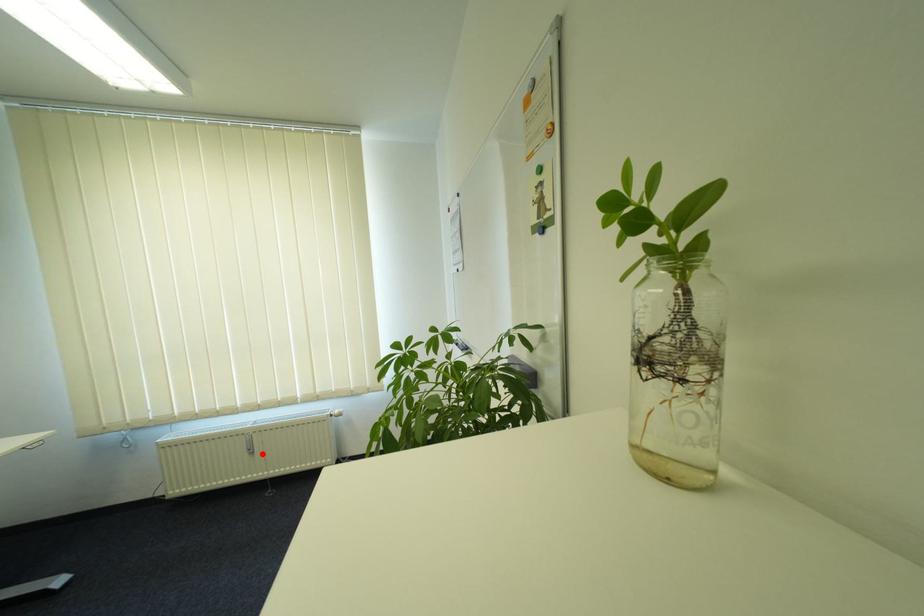
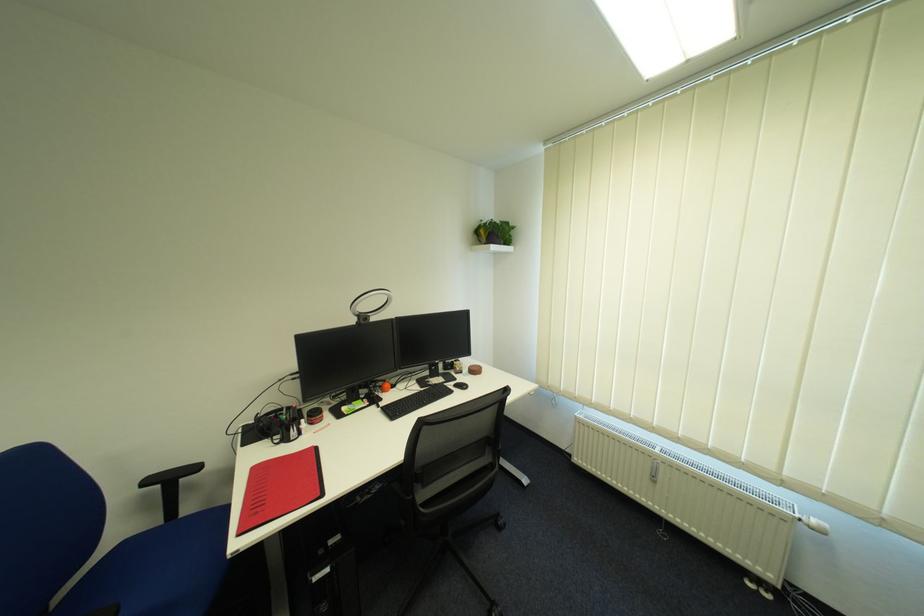
Question: I am providing you with two images of the same scene from different viewpoints. Image1 has a red point marked. In image2, the corresponding 3D location appears at what relative position? Reply with the corresponding letter.

Choices:
 (A) Closer
 (B) Farther

Answer: (A)